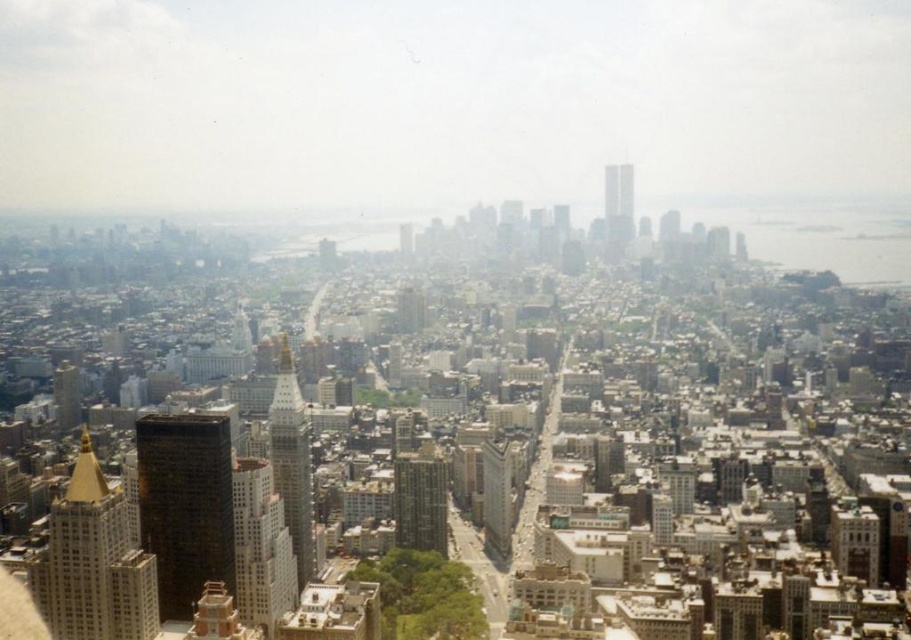
Can you confirm if white marble skyscraper at center is positioned to the right of white glass skyscraper at center?

In fact, white marble skyscraper at center is to the left of white glass skyscraper at center.

Is white marble skyscraper at center positioned at the back of white glass skyscraper at center?

Yes, white marble skyscraper at center is behind white glass skyscraper at center.

This screenshot has width=911, height=640. I want to click on white marble skyscraper at center, so click(260, 547).

The image size is (911, 640). What are the coordinates of `white marble skyscraper at center` in the screenshot? It's located at (260, 547).

Is the position of white marble skyscraper at center less distant than that of smooth glass skyscraper at center?

No, white marble skyscraper at center is further to the viewer.

From the picture: Who is more distant from viewer, (259, 529) or (628, 176)?

The point (259, 529) is more distant.

Who is more distant from viewer, (236,500) or (610,166)?

Positioned behind is point (236,500).

Where is `white marble skyscraper at center`? This screenshot has height=640, width=911. white marble skyscraper at center is located at coordinates (260, 547).

Does dark brown glass skyscraper at lower left have a smaller size compared to goldmaterial/texturetower at center?

Actually, dark brown glass skyscraper at lower left might be larger than goldmaterial/texturetower at center.

How far apart are dark brown glass skyscraper at lower left and goldmaterial/texturetower at center?

dark brown glass skyscraper at lower left and goldmaterial/texturetower at center are 219.94 feet apart from each other.

Is point (228, 428) more distant than point (288, 500)?

Yes, point (228, 428) is behind point (288, 500).

This screenshot has height=640, width=911. I want to click on dark brown glass skyscraper at lower left, so click(185, 506).